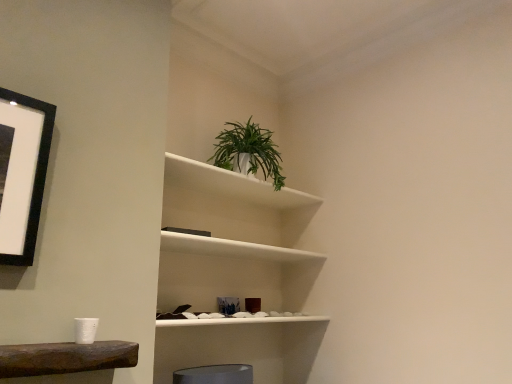
Question: Is green leafy plant in white pot at upper center inside white matte plant at upper center?

Choices:
 (A) no
 (B) yes

Answer: (A)

Question: Considering the relative positions of white matte plant at upper center and green leafy plant in white pot at upper center in the image provided, is white matte plant at upper center in front of green leafy plant in white pot at upper center?

Choices:
 (A) no
 (B) yes

Answer: (B)

Question: Is white matte plant at upper center further to the viewer compared to green leafy plant in white pot at upper center?

Choices:
 (A) no
 (B) yes

Answer: (A)

Question: Is white matte plant at upper center oriented towards green leafy plant in white pot at upper center?

Choices:
 (A) no
 (B) yes

Answer: (A)

Question: Is white matte plant at upper center thinner than green leafy plant in white pot at upper center?

Choices:
 (A) yes
 (B) no

Answer: (B)

Question: From the image's perspective, is white matte plant at upper center on top of green leafy plant in white pot at upper center?

Choices:
 (A) no
 (B) yes

Answer: (A)

Question: Could you tell me if green leafy plant in white pot at upper center is turned towards white matte plant at upper center?

Choices:
 (A) no
 (B) yes

Answer: (A)

Question: From the image's perspective, is green leafy plant in white pot at upper center beneath white matte plant at upper center?

Choices:
 (A) yes
 (B) no

Answer: (B)

Question: Does green leafy plant in white pot at upper center contain white matte plant at upper center?

Choices:
 (A) yes
 (B) no

Answer: (B)

Question: Considering the relative sizes of green leafy plant in white pot at upper center and white matte plant at upper center in the image provided, is green leafy plant in white pot at upper center shorter than white matte plant at upper center?

Choices:
 (A) yes
 (B) no

Answer: (A)

Question: Considering the relative sizes of green leafy plant in white pot at upper center and white matte plant at upper center in the image provided, is green leafy plant in white pot at upper center bigger than white matte plant at upper center?

Choices:
 (A) yes
 (B) no

Answer: (B)

Question: Is green leafy plant in white pot at upper center to the right of white matte plant at upper center from the viewer's perspective?

Choices:
 (A) no
 (B) yes

Answer: (B)

Question: Is white matte plant at upper center spatially inside green leafy plant in white pot at upper center, or outside of it?

Choices:
 (A) inside
 (B) outside

Answer: (B)